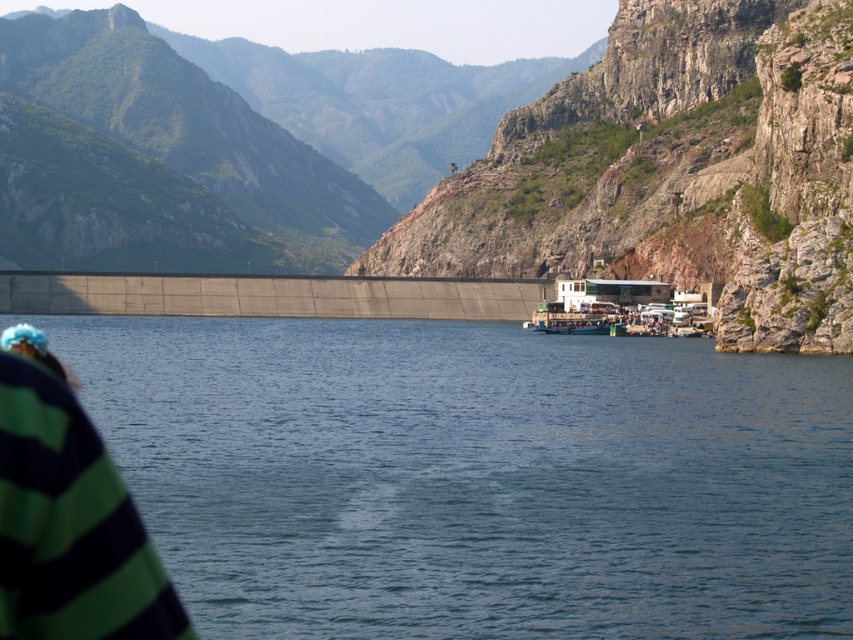
Question: Which object appears closest to the camera in this image?

Choices:
 (A) green striped sweater at lower left
 (B) rocky cliff at upper right
 (C) blue water at center

Answer: (A)

Question: Which point is farther from the camera taking this photo?

Choices:
 (A) (566, 284)
 (B) (38, 582)

Answer: (A)

Question: Is rocky cliff at upper right to the right of white matte boat at center from the viewer's perspective?

Choices:
 (A) yes
 (B) no

Answer: (B)

Question: Which of the following is the closest to the observer?

Choices:
 (A) blue water at center
 (B) rocky cliff at upper right
 (C) green striped sweater at lower left

Answer: (C)

Question: Does blue water at center have a larger size compared to green striped sweater at lower left?

Choices:
 (A) yes
 (B) no

Answer: (A)

Question: Where is rocky cliff at upper right located in relation to green striped sweater at lower left in the image?

Choices:
 (A) left
 (B) right

Answer: (B)